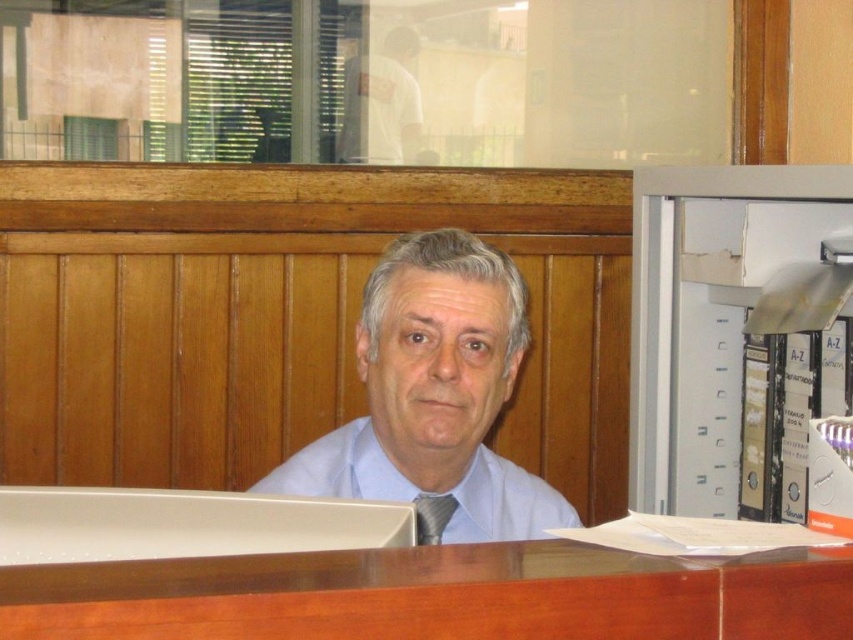
You are an office worker who needs to place a new folder that is 25 cm wide. You see the white plastic file cabinet at right and the white cotton shirt at upper center. Which object can the folder fit on top of?

The white plastic file cabinet at right has a larger width than the white cotton shirt at upper center, so the folder can fit on the white plastic file cabinet at right.

You are a visitor entering an office and see the white plastic file cabinet at right and the white cotton shirt at upper center. Which object is closer to the ceiling?

The white cotton shirt at upper center is closer to the ceiling because it is positioned above the white plastic file cabinet at right.